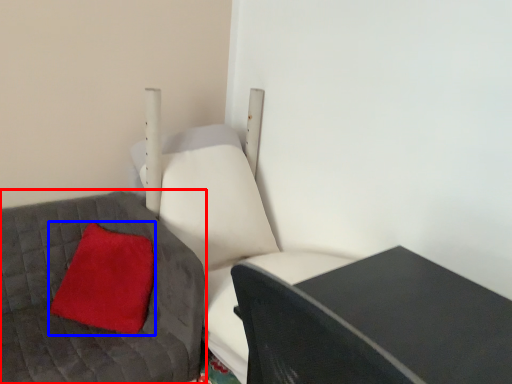
Question: Which point is closer to the camera, furniture (highlighted by a red box) or pillow (highlighted by a blue box)?

Choices:
 (A) furniture
 (B) pillow

Answer: (A)